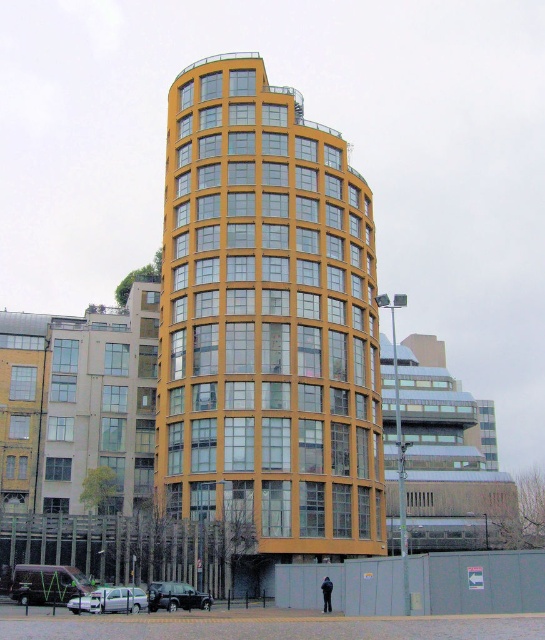
You are standing at the entrance of the yellow glass building at center and want to reach the dark blue fabric at lower center. Which direction should you walk to get there?

You should walk to the right because the yellow glass building at center is to the left of the dark blue fabric at lower center, so moving right from the building will lead you towards the fabric.

You are standing at the entrance of the yellow glass building at center. You want to go to the point marked at coordinates [267,321]. Which direction should you walk?

The yellow glass building at center is already located at point [267,321], so you are already at the desired location.

You are a delivery person standing at the dark blue fabric at lower center, and you need to deliver a package to the yellow glass building at center. What is the shortest distance you need to walk to reach the building?

The shortest distance you need to walk to reach the yellow glass building at center from the dark blue fabric at lower center is 22.38 meters.